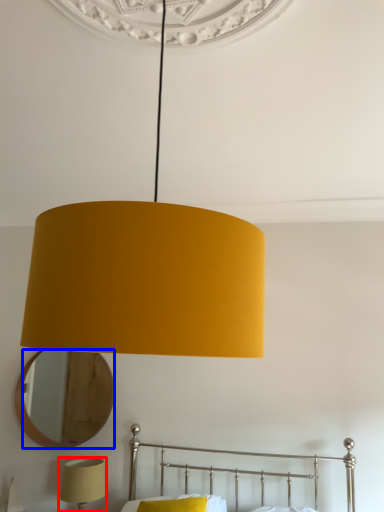
Question: Among these objects, which one is nearest to the camera, lamp (highlighted by a red box) or mirror (highlighted by a blue box)?

Choices:
 (A) lamp
 (B) mirror

Answer: (A)